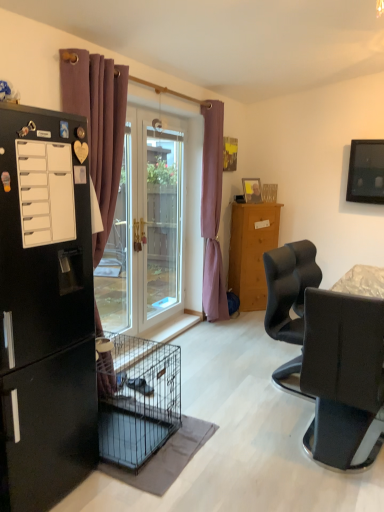
Question: Considering the relative positions of matte black television at upper right and white matte drawer at left in the image provided, is matte black television at upper right to the left of white matte drawer at left from the viewer's perspective?

Choices:
 (A) no
 (B) yes

Answer: (A)

Question: Does matte black television at upper right have a lesser height compared to white matte drawer at left?

Choices:
 (A) yes
 (B) no

Answer: (B)

Question: From a real-world perspective, is matte black television at upper right over white matte drawer at left?

Choices:
 (A) yes
 (B) no

Answer: (A)

Question: Is white matte drawer at left completely or partially inside matte black television at upper right?

Choices:
 (A) no
 (B) yes

Answer: (A)

Question: Is matte black television at upper right bigger than white matte drawer at left?

Choices:
 (A) yes
 (B) no

Answer: (A)

Question: Is matte black chair at right bigger or smaller than black matte refrigerator at left?

Choices:
 (A) big
 (B) small

Answer: (B)

Question: From a real-world perspective, is matte black chair at right positioned above or below black matte refrigerator at left?

Choices:
 (A) above
 (B) below

Answer: (B)

Question: In the image, is matte black chair at right positioned in front of or behind black matte refrigerator at left?

Choices:
 (A) front
 (B) behind

Answer: (B)

Question: Considering the positions of point (344, 403) and point (49, 462), is point (344, 403) closer or farther from the camera than point (49, 462)?

Choices:
 (A) farther
 (B) closer

Answer: (A)

Question: In terms of height, does matte black television at upper right look taller or shorter compared to purple fabric curtain at left, which is the 2th curtain in right-to-left order?

Choices:
 (A) short
 (B) tall

Answer: (A)

Question: Is matte black television at upper right to the left or to the right of purple fabric curtain at left, which is the 2th curtain in right-to-left order, in the image?

Choices:
 (A) left
 (B) right

Answer: (B)

Question: Considering the positions of matte black television at upper right and purple fabric curtain at left, the 1th curtain positioned from the left, in the image, is matte black television at upper right bigger or smaller than purple fabric curtain at left, the 1th curtain positioned from the left,?

Choices:
 (A) big
 (B) small

Answer: (B)

Question: Is point (359, 150) positioned closer to the camera than point (107, 80)?

Choices:
 (A) farther
 (B) closer

Answer: (A)

Question: From the image's perspective, is wooden picture frame at upper center located above or below matte black chair at right?

Choices:
 (A) above
 (B) below

Answer: (A)

Question: From a real-world perspective, is wooden picture frame at upper center physically located above or below matte black chair at right?

Choices:
 (A) below
 (B) above

Answer: (B)